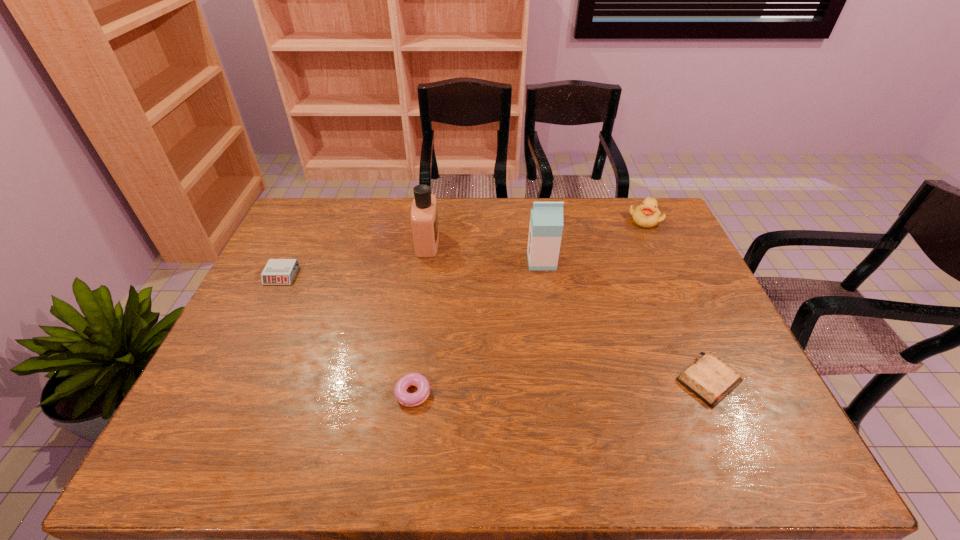
Where is `vacant area that lies between the perfume and the alarm clock`? The image size is (960, 540). vacant area that lies between the perfume and the alarm clock is located at coordinates (354, 259).

Locate an element on the screen. This screenshot has width=960, height=540. free area in between the fourth object from left to right and the perfume is located at coordinates (485, 252).

Where is `vacant space in between the leftmost object and the milk carton`? vacant space in between the leftmost object and the milk carton is located at coordinates (412, 268).

Find the location of a particular element. blank region between the doughnut and the duckling is located at coordinates (531, 307).

At what (x,y) coordinates should I click in order to perform the action: click on vacant area that lies between the perfume and the milk carton. Please return your answer as a coordinate pair (x, y). This screenshot has height=540, width=960. Looking at the image, I should click on (485, 252).

Locate an element on the screen. This screenshot has height=540, width=960. object that is the fourth closest to the milk carton is located at coordinates (412, 379).

Locate an element on the screen. Image resolution: width=960 pixels, height=540 pixels. object that is the second closest to the alarm clock is located at coordinates (412, 379).

This screenshot has width=960, height=540. I want to click on free space in the image that satisfies the following two spatial constraints: 1. on the front label of the fourth object from left to right; 2. on the left side of the perfume, so click(x=425, y=261).

This screenshot has height=540, width=960. What are the coordinates of `free point that satisfies the following two spatial constraints: 1. on the front side of the doughnut; 2. on the right side of the leftmost object` in the screenshot? It's located at (225, 393).

At what (x,y) coordinates should I click in order to perform the action: click on vacant space that satisfies the following two spatial constraints: 1. on the back side of the third object from right to left; 2. on the front label of the perfume. Please return your answer as a coordinate pair (x, y). The width and height of the screenshot is (960, 540). Looking at the image, I should click on (539, 243).